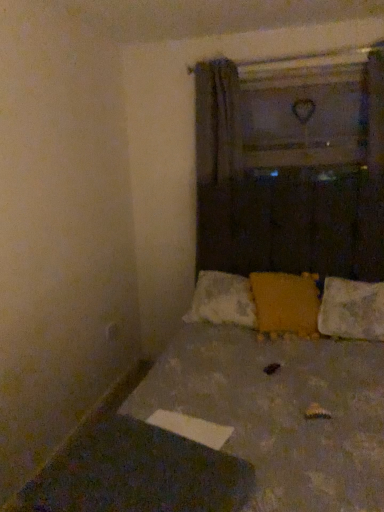
Question: From the image's perspective, relative to white textured pillow at lower right, marked as the second pillow in a left-to-right arrangement, is matte yellow pillow at center, which is the second pillow from right to left, above or below?

Choices:
 (A) above
 (B) below

Answer: (A)

Question: Considering the positions of point (304, 332) and point (355, 289), is point (304, 332) closer or farther from the camera than point (355, 289)?

Choices:
 (A) farther
 (B) closer

Answer: (B)

Question: Estimate the real-world distances between objects in this image. Which object is farther from the matte yellow pillow at center, which ranks as the first pillow in left-to-right order?

Choices:
 (A) textured fabric bed at center
 (B) white textured pillow at lower right, positioned as the first pillow in right-to-left order

Answer: (A)

Question: Estimate the real-world distances between objects in this image. Which object is farther from the white textured pillow at lower right, positioned as the first pillow in right-to-left order?

Choices:
 (A) textured fabric bed at center
 (B) matte yellow pillow at center, which is the second pillow from right to left

Answer: (A)